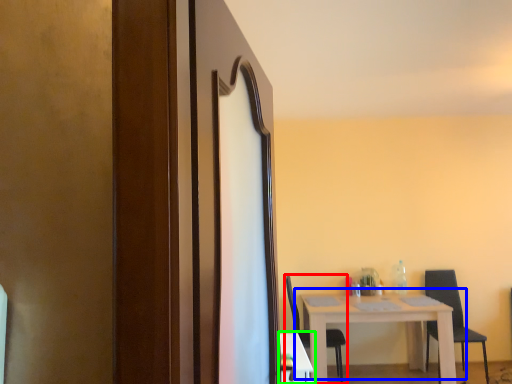
Question: Estimate the real-world distances between objects in this image. Which object is farther from chair (highlighted by a red box), table (highlighted by a blue box) or table (highlighted by a green box)?

Choices:
 (A) table
 (B) table

Answer: (B)